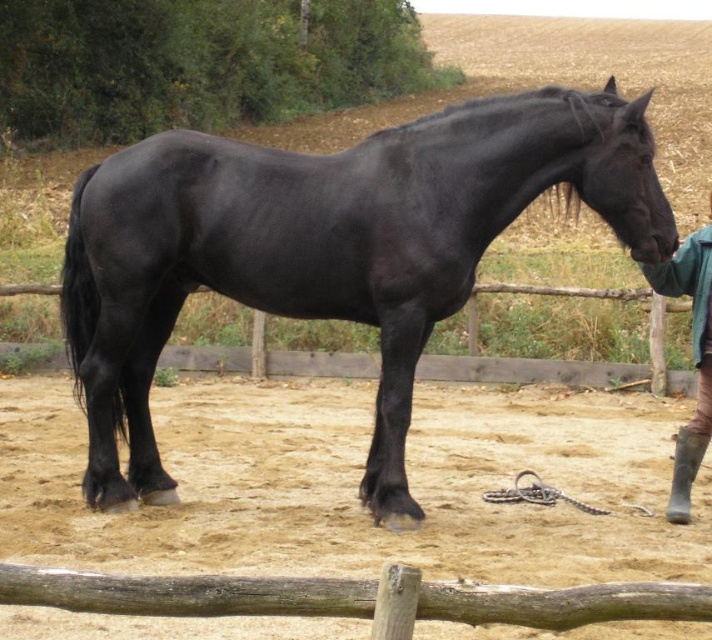
You are a photographer setting up equipment in the paddock. You need to position a tripod between the wooden fence at center and the green fabric jacket at lower right. Based on their positions, which object should the tripod be closer to?

The wooden fence at center is to the left of green fabric jacket at lower right, so the tripod should be placed closer to the wooden fence at center since it is positioned to the left of the jacket.

You are a photographer setting up equipment in the paddock. You have a green fabric jacket at lower right and a wooden fence at center. Which object is closer to the camera?

The green fabric jacket at lower right is closer to the camera because the wooden fence at center is located above it, meaning the jacket is in front.

You are standing in the paddock with the black horse and want to place a hay bale between the two points marked as point (108, 476) and point (703, 324). Since you can only place the hay bale at the closer point to you, which point should you choose?

You should choose point (108, 476) because it is closer to you than point (703, 324), as it is further away.